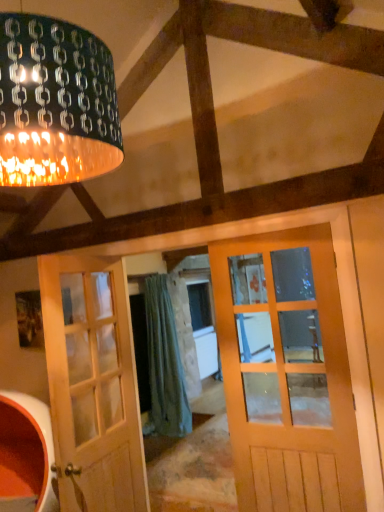
This screenshot has height=512, width=384. What do you see at coordinates (55, 103) in the screenshot?
I see `matte black lampshade at upper left` at bounding box center [55, 103].

Where is `green fabric curtain at center`? green fabric curtain at center is located at coordinates (164, 364).

Could you tell me if white wood door at left is facing green fabric curtain at center?

No, white wood door at left is not oriented towards green fabric curtain at center.

In terms of size, does white wood door at left appear bigger or smaller than green fabric curtain at center?

Considering their sizes, white wood door at left takes up less space than green fabric curtain at center.

Who is shorter, white wood door at left or green fabric curtain at center?

white wood door at left is shorter.

Based on the photo, is white wood door at left inside or outside of green fabric curtain at center?

white wood door at left is not enclosed by green fabric curtain at center.

Considering the sizes of objects green fabric curtain at center and matte black lampshade at upper left in the image provided, who is wider, green fabric curtain at center or matte black lampshade at upper left?

matte black lampshade at upper left is wider.

Can you confirm if green fabric curtain at center is bigger than matte black lampshade at upper left?

Yes, green fabric curtain at center is bigger than matte black lampshade at upper left.

Is the depth of green fabric curtain at center greater than that of matte black lampshade at upper left?

Yes, the depth of green fabric curtain at center is greater than that of matte black lampshade at upper left.

In the image, is green fabric curtain at center on the left side or the right side of matte black lampshade at upper left?

green fabric curtain at center is to the right of matte black lampshade at upper left.

Based on the photo, would you say matte black lampshade at upper left is outside green fabric curtain at center?

Yes, matte black lampshade at upper left is not within green fabric curtain at center.

Considering the relative sizes of matte black lampshade at upper left and green fabric curtain at center in the image provided, is matte black lampshade at upper left smaller than green fabric curtain at center?

Yes, matte black lampshade at upper left is smaller than green fabric curtain at center.

Is matte black lampshade at upper left directly adjacent to green fabric curtain at center?

matte black lampshade at upper left and green fabric curtain at center are clearly separated.

Can you confirm if matte black lampshade at upper left is taller than white wood door at left?

In fact, matte black lampshade at upper left may be shorter than white wood door at left.

From the picture: Is there a large distance between matte black lampshade at upper left and white wood door at left?

matte black lampshade at upper left is far away from white wood door at left.

Is matte black lampshade at upper left looking in the opposite direction of white wood door at left?

No, white wood door at left is not at the back of matte black lampshade at upper left.

Considering the sizes of objects matte black lampshade at upper left and white wood door at left in the image provided, who is wider, matte black lampshade at upper left or white wood door at left?

matte black lampshade at upper left.

Can you tell me how much white wood door at left and matte black lampshade at upper left differ in facing direction?

The facing directions of white wood door at left and matte black lampshade at upper left are 2.82 degrees apart.

Is white wood door at left facing away from matte black lampshade at upper left?

white wood door at left does not have its back to matte black lampshade at upper left.

Find the location of a particular element. The image size is (384, 512). lamp in front of the white wood door at left is located at coordinates coord(55,103).

Which object is more forward, white wood door at left or matte black lampshade at upper left?

Positioned in front is matte black lampshade at upper left.

From a real-world perspective, who is located lower, green fabric curtain at center or white wood door at left?

In real-world perspective, green fabric curtain at center is lower.

Considering the sizes of green fabric curtain at center and white wood door at left in the image, is green fabric curtain at center taller or shorter than white wood door at left?

green fabric curtain at center is taller than white wood door at left.

From the image's perspective, which is above, green fabric curtain at center or white wood door at left?

From the image's view, white wood door at left is above.

Looking at this image, does green fabric curtain at center have a larger size compared to white wood door at left?

Yes, green fabric curtain at center is bigger than white wood door at left.

Where is `curtain behind the white wood door at left`? The height and width of the screenshot is (512, 384). curtain behind the white wood door at left is located at coordinates (164, 364).

I want to click on curtain below the matte black lampshade at upper left (from the image's perspective), so click(164, 364).

When comparing their distances from green fabric curtain at center, does matte black lampshade at upper left or white wood door at left seem further?

Among the two, matte black lampshade at upper left is located further to green fabric curtain at center.

Which object lies further to the anchor point matte black lampshade at upper left, green fabric curtain at center or white wood door at left?

green fabric curtain at center is further to matte black lampshade at upper left.

Looking at the image, which one is located further to white wood door at left, matte black lampshade at upper left or green fabric curtain at center?

green fabric curtain at center is further to white wood door at left.

Estimate the real-world distances between objects in this image. Which object is further from green fabric curtain at center, white wood door at left or matte black lampshade at upper left?

Among the two, matte black lampshade at upper left is located further to green fabric curtain at center.

Which object lies further to the anchor point matte black lampshade at upper left, white wood door at left or green fabric curtain at center?

The object further to matte black lampshade at upper left is green fabric curtain at center.

Considering their positions, is green fabric curtain at center positioned further to white wood door at left than matte black lampshade at upper left?

green fabric curtain at center is positioned further to the anchor white wood door at left.

Where is `door located between matte black lampshade at upper left and green fabric curtain at center in the depth direction`? The height and width of the screenshot is (512, 384). door located between matte black lampshade at upper left and green fabric curtain at center in the depth direction is located at coordinates (93, 385).